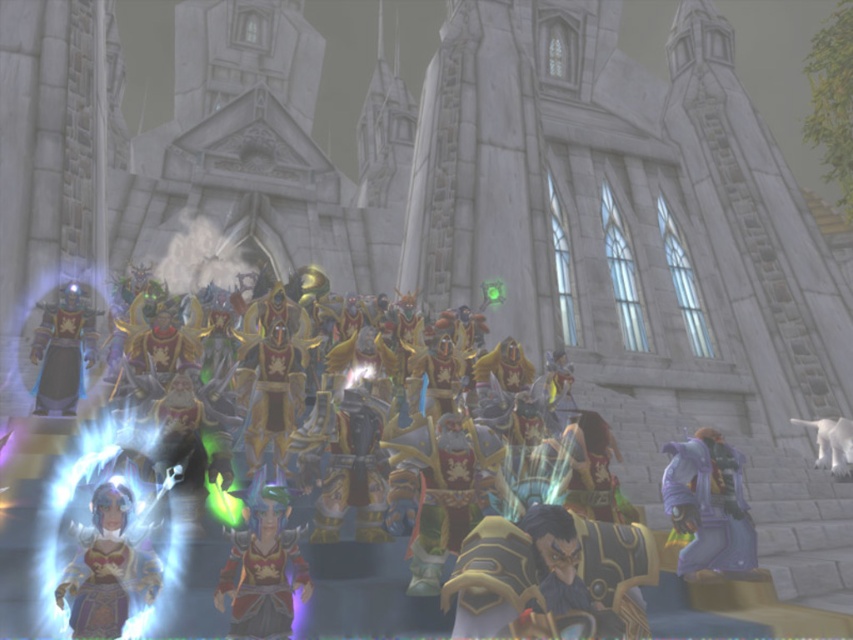
Between purple matte armor at lower right and translucent purple dress at lower left, which one appears on the right side from the viewer's perspective?

purple matte armor at lower right is more to the right.

Is purple matte armor at lower right above translucent purple dress at lower left?

Incorrect, purple matte armor at lower right is not positioned above translucent purple dress at lower left.

Who is more forward, (689, 509) or (99, 512)?

Point (99, 512)

The image size is (853, 640). I want to click on purple matte armor at lower right, so click(x=706, y=504).

Who is higher up, purple matte armor at lower right or shiny gold armor at left?

shiny gold armor at left

Is purple matte armor at lower right to the right of shiny gold armor at left from the viewer's perspective?

Yes, purple matte armor at lower right is to the right of shiny gold armor at left.

Who is more forward, (700, 433) or (33, 396)?

Point (700, 433) is more forward.

Locate an element on the screen. Image resolution: width=853 pixels, height=640 pixels. purple matte armor at lower right is located at coordinates (706, 504).

Who is higher up, shiny gold armor at center or purple matte armor at lower right?

shiny gold armor at center

From the picture: Does shiny gold armor at center have a lesser width compared to purple matte armor at lower right?

Incorrect, shiny gold armor at center's width is not less than purple matte armor at lower right's.

This screenshot has height=640, width=853. What are the coordinates of `shiny gold armor at center` in the screenshot? It's located at (270, 500).